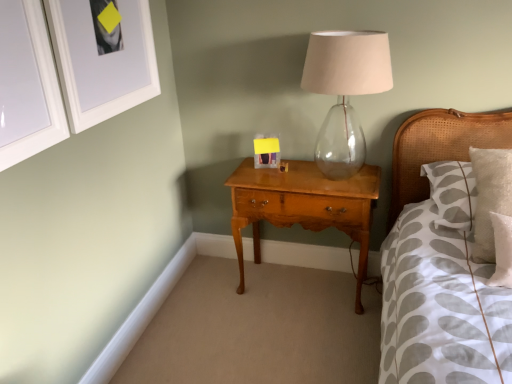
What is the approximate height of transparent glass table lamp at center?

transparent glass table lamp at center is 27.49 inches in height.

Describe the element at coordinates (345, 92) in the screenshot. This screenshot has width=512, height=384. I see `transparent glass table lamp at center` at that location.

Locate an element on the screen. The height and width of the screenshot is (384, 512). woven cane headboard at right is located at coordinates (440, 147).

Locate an element on the screen. white glossy picture frame at upper left, which is counted as the third picture frame, starting from the right is located at coordinates (27, 84).

I want to click on shiny brown wood nightstand at center, so click(303, 206).

From a real-world perspective, between matte plastic picture frame at center, placed as the third picture frame when sorted from left to right, and woven cane headboard at right, who is vertically lower?

matte plastic picture frame at center, placed as the third picture frame when sorted from left to right, is physically lower.

Is matte plastic picture frame at center, marked as the 1th picture frame in a back-to-front arrangement, positioned behind woven cane headboard at right?

Yes, matte plastic picture frame at center, marked as the 1th picture frame in a back-to-front arrangement, is further from the viewer.

Can you confirm if matte plastic picture frame at center, marked as the 1th picture frame in a back-to-front arrangement, is wider than woven cane headboard at right?

Incorrect, the width of matte plastic picture frame at center, marked as the 1th picture frame in a back-to-front arrangement, does not surpass that of woven cane headboard at right.

Which of these two, matte plastic picture frame at center, placed as the third picture frame when sorted from left to right, or woven cane headboard at right, stands shorter?

matte plastic picture frame at center, placed as the third picture frame when sorted from left to right.

Considering the relative sizes of white glossy picture frame at upper left, the 1th picture frame viewed from the front, and shiny brown wood nightstand at center in the image provided, is white glossy picture frame at upper left, the 1th picture frame viewed from the front, wider than shiny brown wood nightstand at center?

Incorrect, the width of white glossy picture frame at upper left, the 1th picture frame viewed from the front, does not surpass that of shiny brown wood nightstand at center.

Is white glossy picture frame at upper left, the third picture frame when ordered from back to front, at the left side of shiny brown wood nightstand at center?

Correct, you'll find white glossy picture frame at upper left, the third picture frame when ordered from back to front, to the left of shiny brown wood nightstand at center.

Is white matte picture frame at upper left, the second picture frame from the back, oriented towards shiny brown wood nightstand at center?

No, white matte picture frame at upper left, the second picture frame from the back, is not aimed at shiny brown wood nightstand at center.

Considering the relative positions of white matte picture frame at upper left, acting as the second picture frame starting from the left, and shiny brown wood nightstand at center in the image provided, is white matte picture frame at upper left, acting as the second picture frame starting from the left, behind shiny brown wood nightstand at center?

No, white matte picture frame at upper left, acting as the second picture frame starting from the left, is in front of shiny brown wood nightstand at center.

Between white matte picture frame at upper left, the second picture frame from the back, and shiny brown wood nightstand at center, which one has smaller width?

white matte picture frame at upper left, the second picture frame from the back.

Considering the sizes of objects white matte picture frame at upper left, arranged as the 2th picture frame when viewed from the front, and shiny brown wood nightstand at center in the image provided, who is smaller, white matte picture frame at upper left, arranged as the 2th picture frame when viewed from the front, or shiny brown wood nightstand at center?

With smaller size is white matte picture frame at upper left, arranged as the 2th picture frame when viewed from the front.

Considering the sizes of objects matte plastic picture frame at center, marked as the 3th picture frame in a front-to-back arrangement, and transparent glass table lamp at center in the image provided, who is smaller, matte plastic picture frame at center, marked as the 3th picture frame in a front-to-back arrangement, or transparent glass table lamp at center?

matte plastic picture frame at center, marked as the 3th picture frame in a front-to-back arrangement, is smaller.

Based on the photo, between matte plastic picture frame at center, which is the 1th picture frame from right to left, and transparent glass table lamp at center, which one has smaller width?

matte plastic picture frame at center, which is the 1th picture frame from right to left.

From a real-world perspective, is matte plastic picture frame at center, marked as the 3th picture frame in a front-to-back arrangement, physically located above or below transparent glass table lamp at center?

From a real-world perspective, matte plastic picture frame at center, marked as the 3th picture frame in a front-to-back arrangement, is physically below transparent glass table lamp at center.

Is matte plastic picture frame at center, marked as the 1th picture frame in a back-to-front arrangement, completely or partially outside of transparent glass table lamp at center?

Yes.

Could you tell me if matte plastic picture frame at center, marked as the 3th picture frame in a front-to-back arrangement, is facing white matte picture frame at upper left, the second picture frame when ordered from right to left?

No, matte plastic picture frame at center, marked as the 3th picture frame in a front-to-back arrangement, is not facing towards white matte picture frame at upper left, the second picture frame when ordered from right to left.

Which is nearer, (274, 167) or (96, 18)?

Positioned in front is point (96, 18).

From a real-world perspective, who is located lower, matte plastic picture frame at center, which is the 1th picture frame from right to left, or white matte picture frame at upper left, the second picture frame when ordered from right to left?

matte plastic picture frame at center, which is the 1th picture frame from right to left, is physically lower.

How different are the orientations of matte plastic picture frame at center, marked as the 3th picture frame in a front-to-back arrangement, and white matte picture frame at upper left, the second picture frame when ordered from right to left, in degrees?

The angle between the facing direction of matte plastic picture frame at center, marked as the 3th picture frame in a front-to-back arrangement, and the facing direction of white matte picture frame at upper left, the second picture frame when ordered from right to left, is 88.2 degrees.

Is white matte picture frame at upper left, acting as the second picture frame starting from the left, positioned beyond the bounds of matte plastic picture frame at center, marked as the 3th picture frame in a front-to-back arrangement?

white matte picture frame at upper left, acting as the second picture frame starting from the left, is positioned outside matte plastic picture frame at center, marked as the 3th picture frame in a front-to-back arrangement.

Could you tell me if white matte picture frame at upper left, the second picture frame when ordered from right to left, is facing matte plastic picture frame at center, placed as the third picture frame when sorted from left to right?

No, white matte picture frame at upper left, the second picture frame when ordered from right to left, does not turn towards matte plastic picture frame at center, placed as the third picture frame when sorted from left to right.

Is white matte picture frame at upper left, acting as the second picture frame starting from the left, taller than matte plastic picture frame at center, placed as the third picture frame when sorted from left to right?

Yes, white matte picture frame at upper left, acting as the second picture frame starting from the left, is taller than matte plastic picture frame at center, placed as the third picture frame when sorted from left to right.

Is white matte picture frame at upper left, arranged as the 2th picture frame when viewed from the front, far from matte plastic picture frame at center, placed as the third picture frame when sorted from left to right?

No, there isn't a large distance between white matte picture frame at upper left, arranged as the 2th picture frame when viewed from the front, and matte plastic picture frame at center, placed as the third picture frame when sorted from left to right.

From a real-world perspective, is transparent glass table lamp at center under shiny brown wood nightstand at center?

No, from a real-world perspective, transparent glass table lamp at center is not beneath shiny brown wood nightstand at center.

Does transparent glass table lamp at center turn towards shiny brown wood nightstand at center?

No, transparent glass table lamp at center is not facing towards shiny brown wood nightstand at center.

Is transparent glass table lamp at center taller than shiny brown wood nightstand at center?

No, transparent glass table lamp at center is not taller than shiny brown wood nightstand at center.

Find the location of a particular element. The width and height of the screenshot is (512, 384). table lamp that is above the shiny brown wood nightstand at center (from the image's perspective) is located at coordinates (345, 92).

Where is `picture frame behind the woven cane headboard at right`? The width and height of the screenshot is (512, 384). picture frame behind the woven cane headboard at right is located at coordinates (266, 151).

Locate an element on the screen. The height and width of the screenshot is (384, 512). nightstand on the right of white glossy picture frame at upper left, which ranks as the 1th picture frame in left-to-right order is located at coordinates (303, 206).

Considering their positions, is matte plastic picture frame at center, marked as the 3th picture frame in a front-to-back arrangement, positioned further to transparent glass table lamp at center than shiny brown wood nightstand at center?

matte plastic picture frame at center, marked as the 3th picture frame in a front-to-back arrangement, is further to transparent glass table lamp at center.

Estimate the real-world distances between objects in this image. Which object is closer to white glossy picture frame at upper left, the third picture frame when ordered from back to front, shiny brown wood nightstand at center or woven cane headboard at right?

Based on the image, shiny brown wood nightstand at center appears to be nearer to white glossy picture frame at upper left, the third picture frame when ordered from back to front.

Considering their positions, is transparent glass table lamp at center positioned further to white glossy picture frame at upper left, the 1th picture frame viewed from the front, than matte plastic picture frame at center, marked as the 1th picture frame in a back-to-front arrangement?

Based on the image, matte plastic picture frame at center, marked as the 1th picture frame in a back-to-front arrangement, appears to be further to white glossy picture frame at upper left, the 1th picture frame viewed from the front.

Considering their positions, is shiny brown wood nightstand at center positioned closer to matte plastic picture frame at center, marked as the 1th picture frame in a back-to-front arrangement, than woven cane headboard at right?

The object closer to matte plastic picture frame at center, marked as the 1th picture frame in a back-to-front arrangement, is shiny brown wood nightstand at center.

Which object lies nearer to the anchor point shiny brown wood nightstand at center, transparent glass table lamp at center or woven cane headboard at right?

woven cane headboard at right.

Looking at the image, which one is located closer to shiny brown wood nightstand at center, transparent glass table lamp at center or white matte picture frame at upper left, the second picture frame when ordered from right to left?

transparent glass table lamp at center is positioned closer to the anchor shiny brown wood nightstand at center.

Based on their spatial positions, is white glossy picture frame at upper left, the third picture frame when ordered from back to front, or matte plastic picture frame at center, which is the 1th picture frame from right to left, further from shiny brown wood nightstand at center?

Among the two, white glossy picture frame at upper left, the third picture frame when ordered from back to front, is located further to shiny brown wood nightstand at center.

From the image, which object appears to be nearer to matte plastic picture frame at center, marked as the 3th picture frame in a front-to-back arrangement, white matte picture frame at upper left, the second picture frame when ordered from right to left, or white glossy picture frame at upper left, the third picture frame when ordered from back to front?

white matte picture frame at upper left, the second picture frame when ordered from right to left, is positioned closer to the anchor matte plastic picture frame at center, marked as the 3th picture frame in a front-to-back arrangement.

I want to click on picture frame between white matte picture frame at upper left, the second picture frame from the back, and transparent glass table lamp at center from left to right, so point(266,151).

Locate an element on the screen. This screenshot has width=512, height=384. nightstand between white glossy picture frame at upper left, the 1th picture frame viewed from the front, and matte plastic picture frame at center, marked as the 1th picture frame in a back-to-front arrangement, in the front-back direction is located at coordinates (303, 206).

Where is `picture frame between white matte picture frame at upper left, arranged as the 2th picture frame when viewed from the front, and shiny brown wood nightstand at center, in the horizontal direction`? picture frame between white matte picture frame at upper left, arranged as the 2th picture frame when viewed from the front, and shiny brown wood nightstand at center, in the horizontal direction is located at coordinates (266, 151).

You are a GUI agent. You are given a task and a screenshot of the screen. Output one action in this format:
    pyautogui.click(x=<x>, y=<y>)
    Task: Click on the table lamp located between white glossy picture frame at upper left, the third picture frame when ordered from back to front, and woven cane headboard at right in the left-right direction
    The width and height of the screenshot is (512, 384).
    Given the screenshot: What is the action you would take?
    pyautogui.click(x=345, y=92)